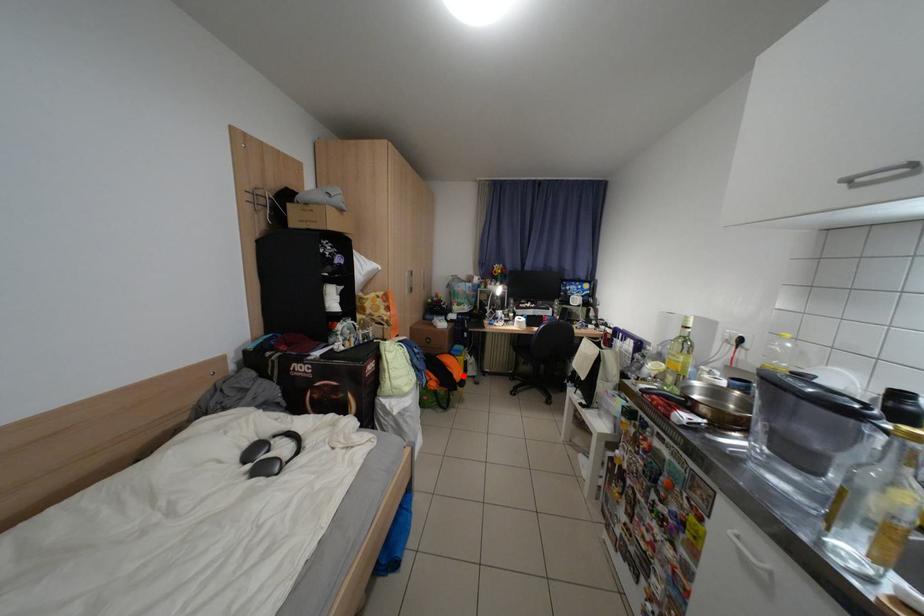
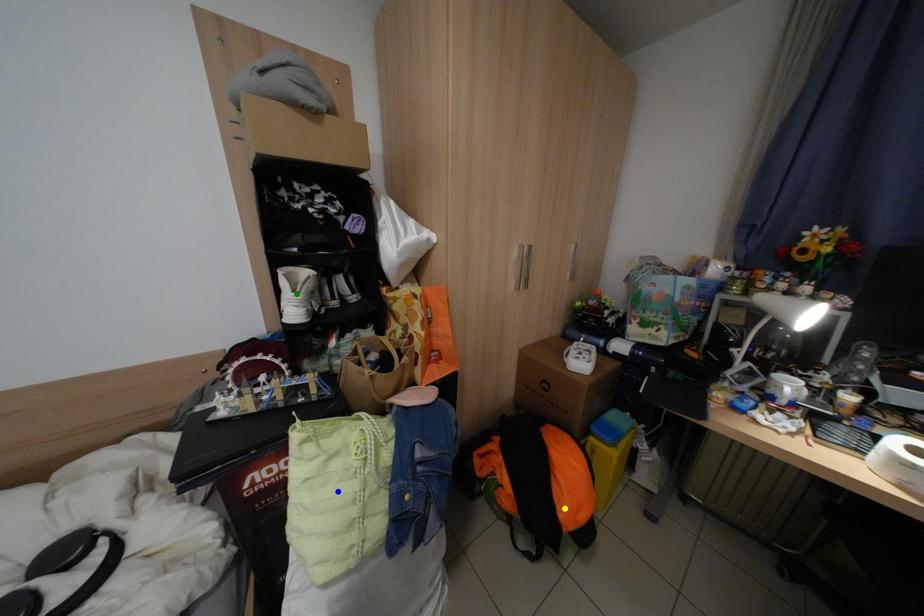
Question: I am providing you with two images of the same scene from different viewpoints. A red point is marked on the first image. You are given multiple points on the second image. Which point in image 2 is actually the same real-world point as the red point in image 1?

Choices:
 (A) blue point
 (B) green point
 (C) yellow point

Answer: (C)